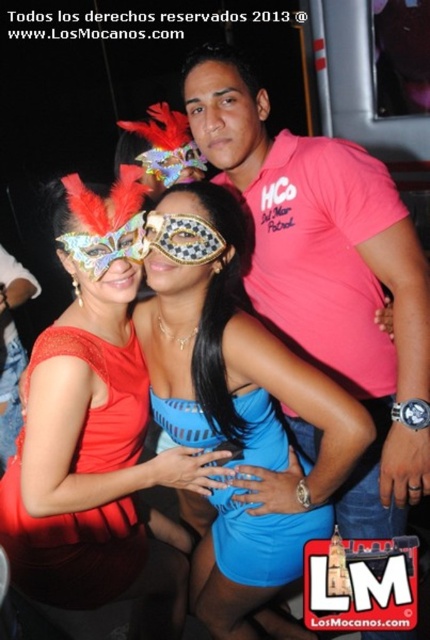
You are a photographer at the event and need to capture a photo where both the shiny blue dress at center and the blue satin dress at center are visible. Since the dresses are different in height, which dress will appear taller in the photo?

The shiny blue dress at center will appear taller in the photo because it has a greater height compared to the blue satin dress at center.

You are a photographer at the event and want to capture a group photo of the blue satin dress at center and the red satin dress at center. To ensure both dresses are fully visible in the frame, which dress should you position closer to the camera to account for their widths?

The blue satin dress at center might be wider than the red satin dress at center, so positioning the blue satin dress at center closer to the camera would help ensure its full width is captured in the photo.